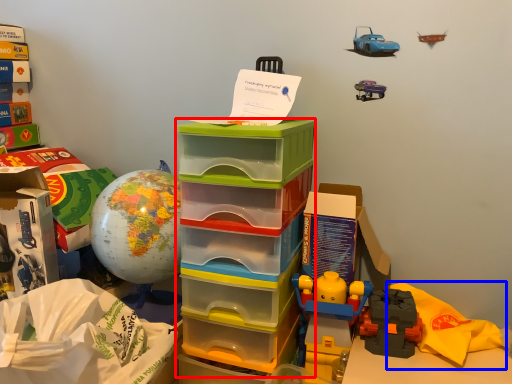
Question: Which of the following is the farthest to the observer, storage box (highlighted by a red box) or material (highlighted by a blue box)?

Choices:
 (A) storage box
 (B) material

Answer: (B)